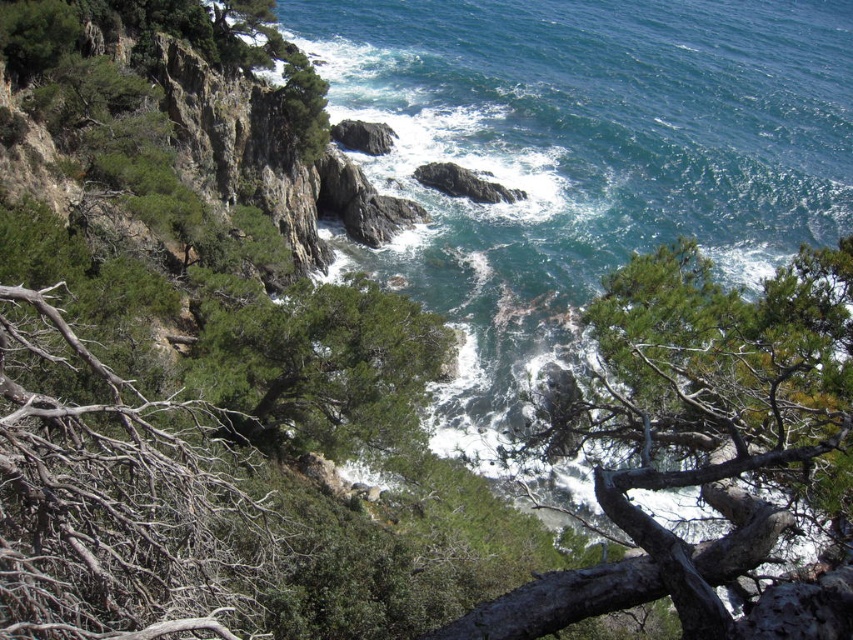
Is brown dry branches at left to the right of rough rock at center from the viewer's perspective?

Incorrect, brown dry branches at left is not on the right side of rough rock at center.

The height and width of the screenshot is (640, 853). I want to click on brown dry branches at left, so click(x=115, y=500).

Find the location of a particular element. This screenshot has height=640, width=853. brown dry branches at left is located at coordinates (115, 500).

Does brown dry branches at left lie behind green leafy tree at center?

No.

Does brown dry branches at left have a smaller size compared to green leafy tree at center?

Yes, brown dry branches at left is smaller than green leafy tree at center.

Does point (172, 433) come farther from viewer compared to point (279, 320)?

No, it is in front of (279, 320).

Image resolution: width=853 pixels, height=640 pixels. Find the location of `brown dry branches at left`. brown dry branches at left is located at coordinates (115, 500).

Consider the image. Is green rough tree at center smaller than brown dry branches at left?

Incorrect, green rough tree at center is not smaller in size than brown dry branches at left.

Who is shorter, green rough tree at center or brown dry branches at left?

brown dry branches at left

Who is more distant from viewer, (824,627) or (181,557)?

The point (824,627) is more distant.

This screenshot has width=853, height=640. What are the coordinates of `green rough tree at center` in the screenshot? It's located at (706, 445).